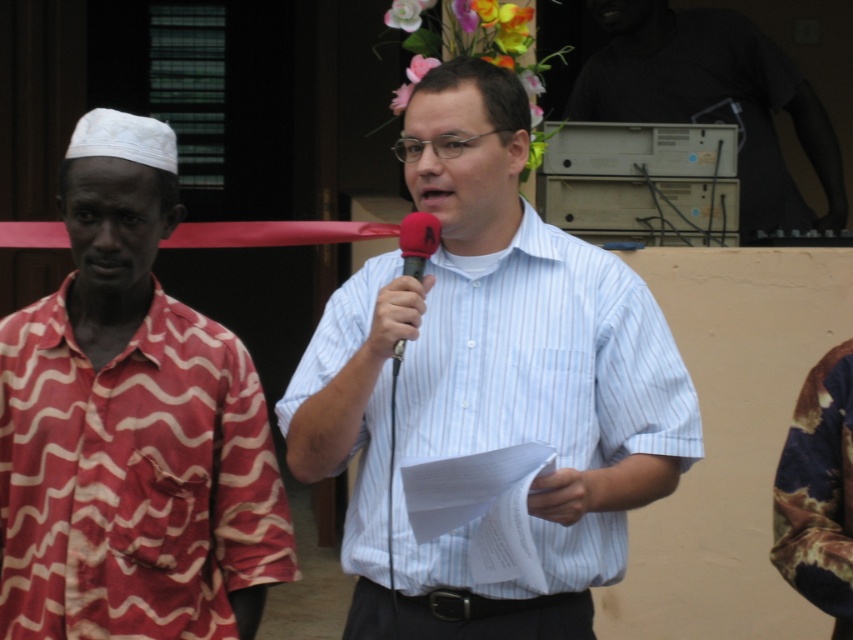
Can you confirm if wavy fabric shirt at left is positioned to the left of red matte microphone at center?

Correct, you'll find wavy fabric shirt at left to the left of red matte microphone at center.

Describe the element at coordinates (131, 428) in the screenshot. This screenshot has width=853, height=640. I see `wavy fabric shirt at left` at that location.

Is point (221, 426) closer to viewer compared to point (432, 230)?

No, it is behind (432, 230).

The width and height of the screenshot is (853, 640). What are the coordinates of `wavy fabric shirt at left` in the screenshot? It's located at (131, 428).

Does wavy fabric shirt at left have a lesser height compared to light blue striped shirt at center?

In fact, wavy fabric shirt at left may be taller than light blue striped shirt at center.

Is point (202, 380) closer to viewer compared to point (469, 282)?

That is True.

Is point (45, 548) positioned behind point (590, 262)?

No, it is in front of (590, 262).

Locate an element on the screen. wavy fabric shirt at left is located at coordinates (131, 428).

Between light blue striped shirt at center and red matte microphone at center, which one is positioned higher?

red matte microphone at center is higher up.

Is light blue striped shirt at center wider than red matte microphone at center?

Yes, light blue striped shirt at center is wider than red matte microphone at center.

Locate an element on the screen. This screenshot has width=853, height=640. light blue striped shirt at center is located at coordinates (534, 378).